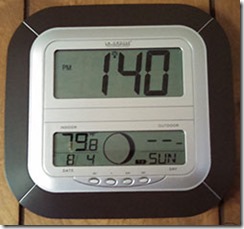
Identify the location of cheap digital clock. The width and height of the screenshot is (244, 229). (216, 80).